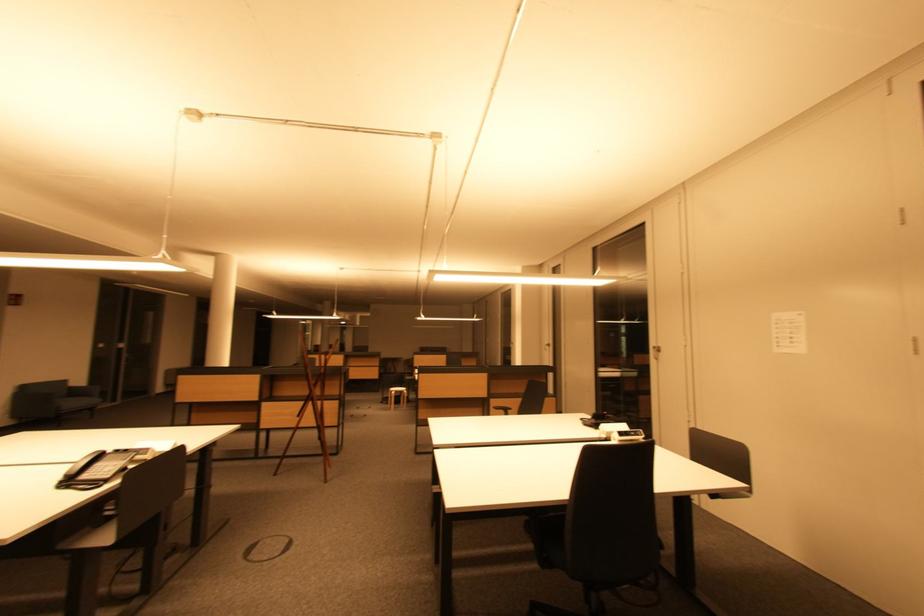
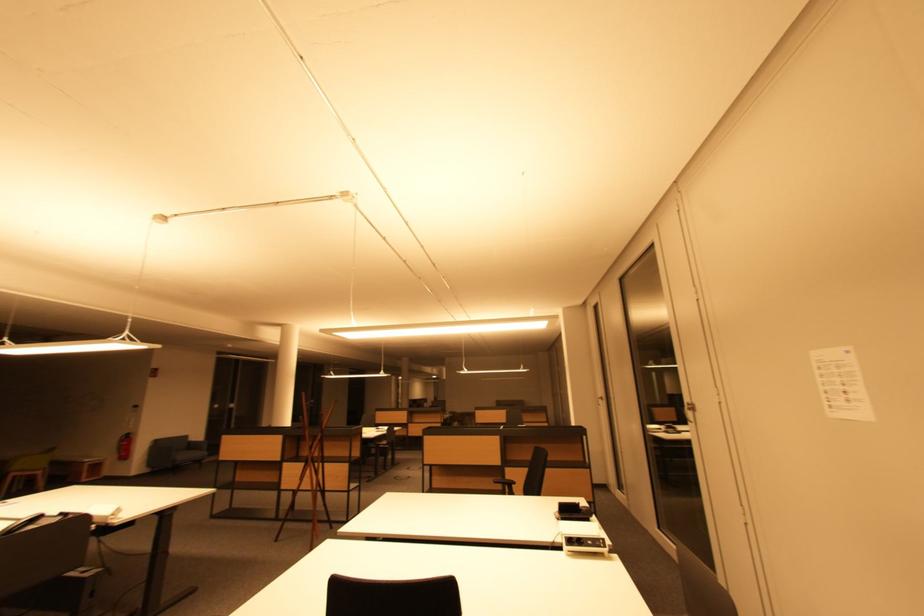
Where in the second image is the point corresponding to the point at 76,406 from the first image?

(188, 458)